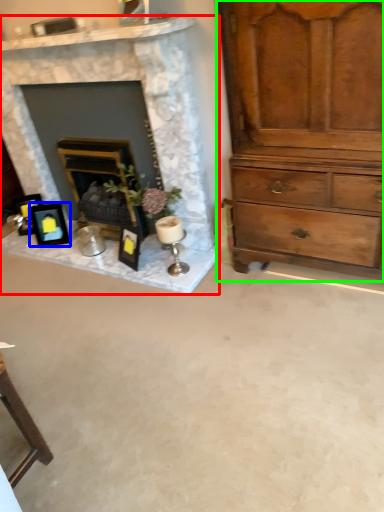
Question: Which is farther away from fireplace (highlighted by a red box)? picture frame (highlighted by a blue box) or chest of drawers (highlighted by a green box)?

Choices:
 (A) picture frame
 (B) chest of drawers

Answer: (A)